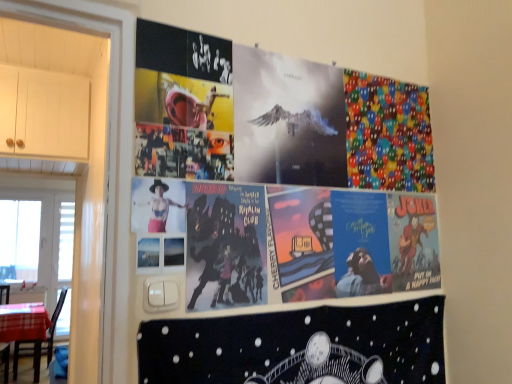
Question: Is there a large distance between black matte poster at lower center and matte black figure at center?

Choices:
 (A) no
 (B) yes

Answer: (A)

Question: Does black matte poster at lower center have a greater height compared to matte black figure at center?

Choices:
 (A) no
 (B) yes

Answer: (B)

Question: Is matte black figure at center inside black matte poster at lower center?

Choices:
 (A) yes
 (B) no

Answer: (B)

Question: From the image's perspective, is black matte poster at lower center beneath matte black figure at center?

Choices:
 (A) yes
 (B) no

Answer: (A)

Question: From a real-world perspective, is black matte poster at lower center positioned over matte black figure at center based on gravity?

Choices:
 (A) no
 (B) yes

Answer: (A)

Question: Does black matte poster at lower center appear on the right side of matte black figure at center?

Choices:
 (A) no
 (B) yes

Answer: (B)

Question: Is the depth of brown wooden chair at lower left greater than that of black matte poster at lower center?

Choices:
 (A) no
 (B) yes

Answer: (B)

Question: Does brown wooden chair at lower left have a smaller size compared to black matte poster at lower center?

Choices:
 (A) no
 (B) yes

Answer: (A)

Question: Does brown wooden chair at lower left have a greater height compared to black matte poster at lower center?

Choices:
 (A) no
 (B) yes

Answer: (B)

Question: Can you confirm if brown wooden chair at lower left is wider than black matte poster at lower center?

Choices:
 (A) yes
 (B) no

Answer: (A)

Question: Is brown wooden chair at lower left touching black matte poster at lower center?

Choices:
 (A) yes
 (B) no

Answer: (B)

Question: Can you confirm if brown wooden chair at lower left is positioned to the left of black matte poster at lower center?

Choices:
 (A) no
 (B) yes

Answer: (B)

Question: Could you tell me if colorful fabric pac-man at upper right is facing white plastic window screen at left, the 1th window screen positioned from the right?

Choices:
 (A) no
 (B) yes

Answer: (A)